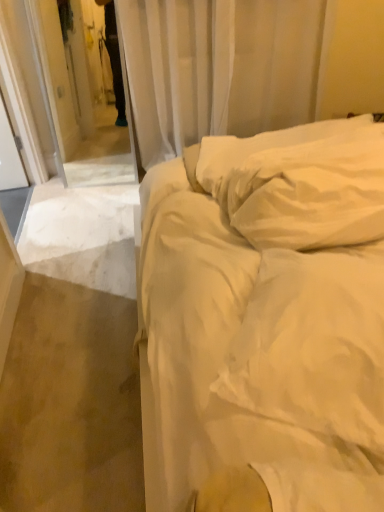
Question: Does white cotton bed at center come behind white soft pillow at upper right?

Choices:
 (A) yes
 (B) no

Answer: (B)

Question: Considering the relative sizes of white cotton bed at center and white soft pillow at upper right in the image provided, is white cotton bed at center thinner than white soft pillow at upper right?

Choices:
 (A) no
 (B) yes

Answer: (A)

Question: Can you confirm if white cotton bed at center is shorter than white soft pillow at upper right?

Choices:
 (A) no
 (B) yes

Answer: (A)

Question: Does white cotton bed at center come in front of white soft pillow at upper right?

Choices:
 (A) yes
 (B) no

Answer: (A)

Question: Is white soft pillow at upper right completely or partially inside white cotton bed at center?

Choices:
 (A) no
 (B) yes

Answer: (B)

Question: Is white cotton bed at center situated inside white sheer curtain at upper center or outside?

Choices:
 (A) outside
 (B) inside

Answer: (A)

Question: Based on their sizes in the image, would you say white cotton bed at center is bigger or smaller than white sheer curtain at upper center?

Choices:
 (A) big
 (B) small

Answer: (A)

Question: Would you say white cotton bed at center is to the left or to the right of white sheer curtain at upper center in the picture?

Choices:
 (A) right
 (B) left

Answer: (A)

Question: From the image's perspective, is white cotton bed at center located above or below white sheer curtain at upper center?

Choices:
 (A) above
 (B) below

Answer: (B)

Question: Is white cotton bed at center bigger or smaller than white soft pillow at upper right?

Choices:
 (A) big
 (B) small

Answer: (A)

Question: Considering the positions of white cotton bed at center and white soft pillow at upper right in the image, is white cotton bed at center wider or thinner than white soft pillow at upper right?

Choices:
 (A) wide
 (B) thin

Answer: (A)

Question: Is white cotton bed at center taller or shorter than white soft pillow at upper right?

Choices:
 (A) tall
 (B) short

Answer: (A)

Question: Is white cotton bed at center in front of or behind white soft pillow at upper right in the image?

Choices:
 (A) behind
 (B) front

Answer: (B)

Question: Is white soft pillow at upper right in front of or behind white cotton bed at center in the image?

Choices:
 (A) front
 (B) behind

Answer: (B)

Question: From the image's perspective, is white soft pillow at upper right above or below white cotton bed at center?

Choices:
 (A) above
 (B) below

Answer: (A)